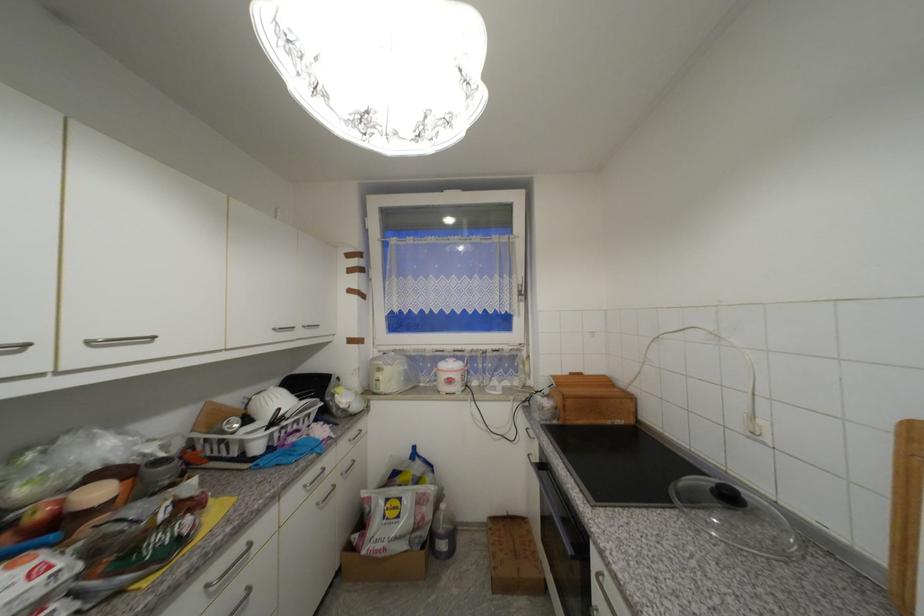
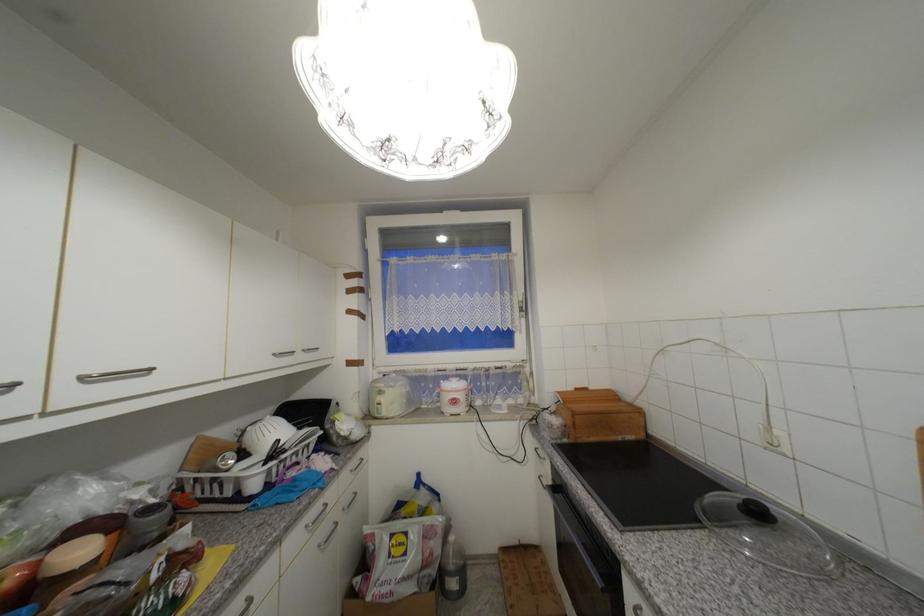
In the second image, find the point that corresponds to the point at 302,422 in the first image.

(301, 454)